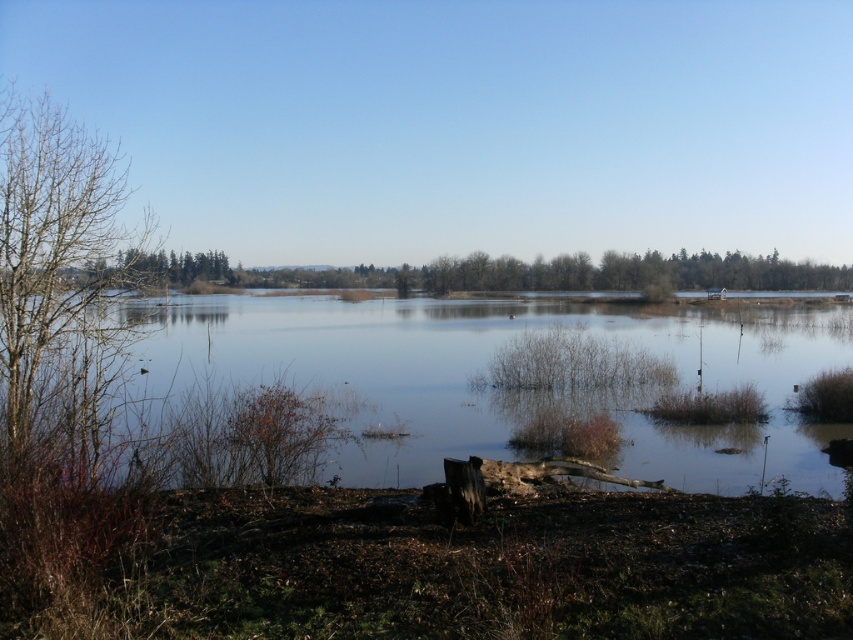
Based on the scene description, what is located at the coordinates point (508, 376)?

The clear water at center is located at point (508, 376).

Looking at this image, you are an environmental scientist assessing the area. You need to determine which object occupies more space in the image between the clear water at center and the bare branches at left. Which one is larger?

The clear water at center is bigger than the bare branches at left, so the clear water at center occupies more space in the image.